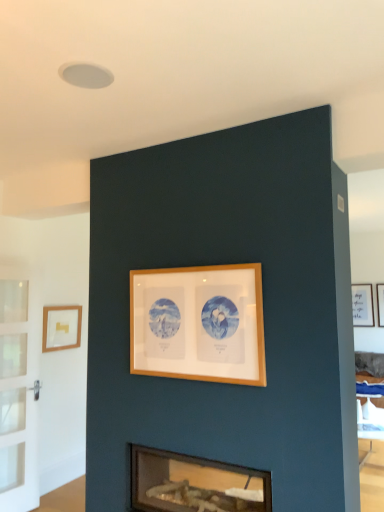
Question: Is wooden frame at center, the 2th picture frame viewed from the right, surrounded by matte glass fireplace at lower center?

Choices:
 (A) yes
 (B) no

Answer: (B)

Question: Is matte glass fireplace at lower center positioned in front of wooden frame at center, the 2th picture frame viewed from the right?

Choices:
 (A) yes
 (B) no

Answer: (A)

Question: From a real-world perspective, is matte glass fireplace at lower center beneath wooden frame at center, marked as the 2th picture frame in a left-to-right arrangement?

Choices:
 (A) yes
 (B) no

Answer: (A)

Question: Considering the relative positions of matte glass fireplace at lower center and wooden frame at center, marked as the first picture frame in a front-to-back arrangement, in the image provided, is matte glass fireplace at lower center to the right of wooden frame at center, marked as the first picture frame in a front-to-back arrangement, from the viewer's perspective?

Choices:
 (A) yes
 (B) no

Answer: (A)

Question: Is matte glass fireplace at lower center facing away from wooden frame at center, which ranks as the third picture frame in back-to-front order?

Choices:
 (A) no
 (B) yes

Answer: (A)

Question: Visually, is wooden frame at center, which ranks as the third picture frame in back-to-front order, positioned to the left or to the right of matte glass fireplace at lower center?

Choices:
 (A) left
 (B) right

Answer: (A)

Question: From a real-world perspective, is wooden frame at center, marked as the first picture frame in a front-to-back arrangement, above or below matte glass fireplace at lower center?

Choices:
 (A) above
 (B) below

Answer: (A)

Question: Is wooden frame at center, marked as the 2th picture frame in a left-to-right arrangement, bigger or smaller than matte glass fireplace at lower center?

Choices:
 (A) small
 (B) big

Answer: (A)

Question: Does point (259, 366) appear closer or farther from the camera than point (155, 480)?

Choices:
 (A) farther
 (B) closer

Answer: (B)

Question: From the image's perspective, relative to wooden frame at center, which ranks as the third picture frame in back-to-front order, is matte gold picture frame at left, the second picture frame from the front, above or below?

Choices:
 (A) above
 (B) below

Answer: (B)

Question: Choose the correct answer: Is matte gold picture frame at left, which ranks as the third picture frame in right-to-left order, inside wooden frame at center, marked as the first picture frame in a front-to-back arrangement, or outside it?

Choices:
 (A) outside
 (B) inside

Answer: (A)

Question: Considering the positions of matte gold picture frame at left, which is the 1th picture frame from left to right, and wooden frame at center, which ranks as the third picture frame in back-to-front order, in the image, is matte gold picture frame at left, which is the 1th picture frame from left to right, taller or shorter than wooden frame at center, which ranks as the third picture frame in back-to-front order,?

Choices:
 (A) short
 (B) tall

Answer: (A)

Question: From a real-world perspective, is matte gold picture frame at left, which ranks as the third picture frame in right-to-left order, physically located above or below wooden frame at center, marked as the 2th picture frame in a left-to-right arrangement?

Choices:
 (A) above
 (B) below

Answer: (B)

Question: In terms of height, does white matte picture frame at upper right, marked as the 3th picture frame in a front-to-back arrangement, look taller or shorter compared to matte gold picture frame at left, the second picture frame from the front?

Choices:
 (A) short
 (B) tall

Answer: (B)

Question: Looking at their shapes, would you say white matte picture frame at upper right, acting as the 1th picture frame starting from the right, is wider or thinner than matte gold picture frame at left, which ranks as the third picture frame in right-to-left order?

Choices:
 (A) wide
 (B) thin

Answer: (B)